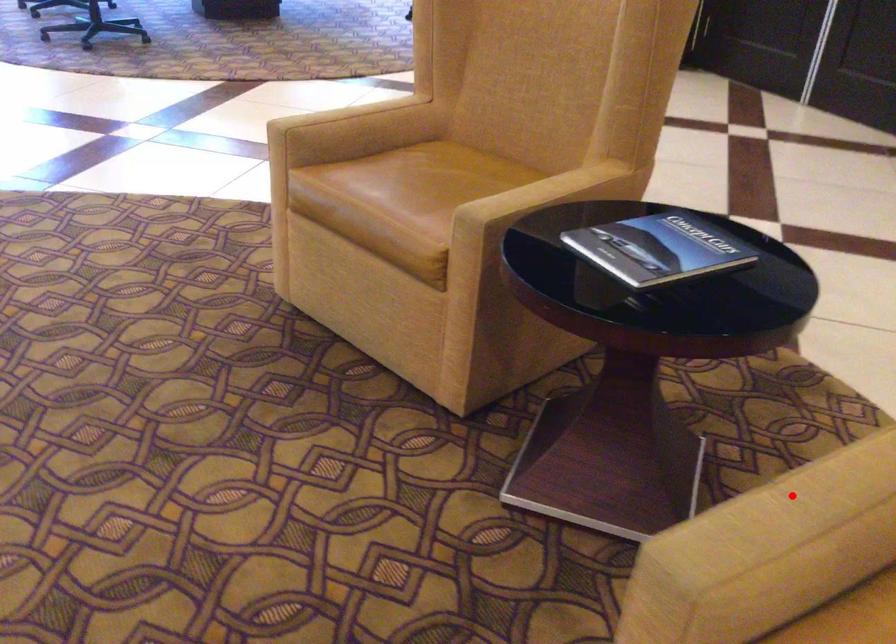
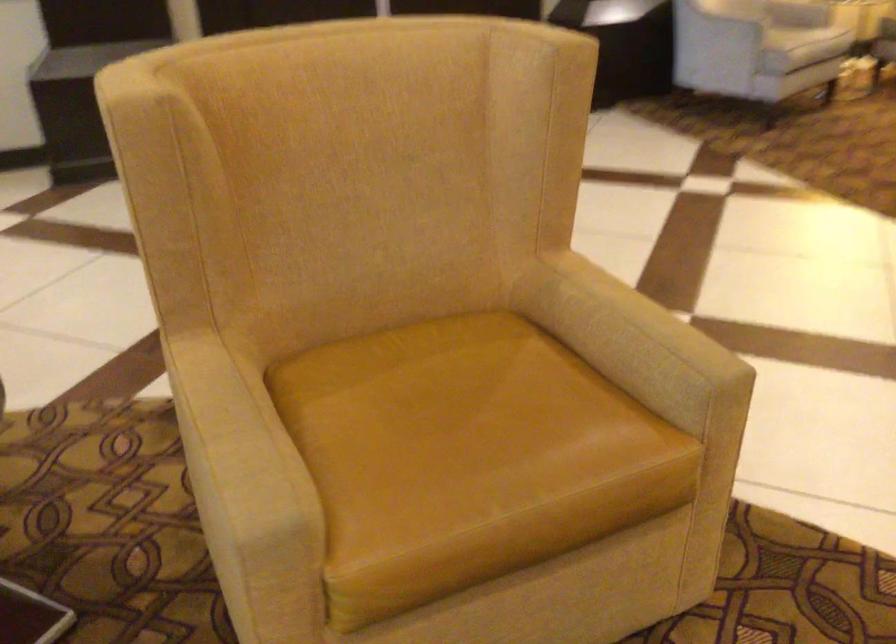
Question: I am providing you with two images of the same scene from different viewpoints. Image1 has a red point marked. In image2, the corresponding 3D location appears at what relative position? Reply with the corresponding letter.

Choices:
 (A) Closer
 (B) Farther

Answer: (B)